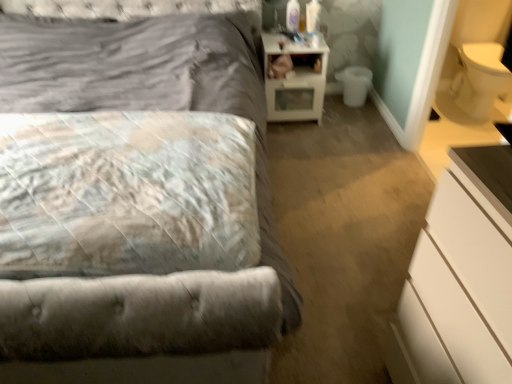
In order to face velvet gray bed at center, should I rotate leftwards or rightwards?

You should rotate left by 22.504 degrees.

You are a GUI agent. You are given a task and a screenshot of the screen. Output one action in this format:
    pyautogui.click(x=<x>, y=<y>)
    Task: Click on the fluffy white pillow at left
    
    Given the screenshot: What is the action you would take?
    pyautogui.click(x=126, y=193)

From the image's perspective, does white glossy nightstand at upper right appear lower than velvet gray bed at center?

No.

Where is `nightstand that appears on the right of velvet gray bed at center`? nightstand that appears on the right of velvet gray bed at center is located at coordinates (295, 79).

Which is behind, white glossy nightstand at upper right or velvet gray bed at center?

Positioned behind is white glossy nightstand at upper right.

Based on the photo, measure the distance from white glossy nightstand at upper right to velvet gray bed at center.

white glossy nightstand at upper right is 17.91 inches away from velvet gray bed at center.

Considering the relative positions of velvet gray bed at center and fluffy white pillow at left in the image provided, is velvet gray bed at center to the right of fluffy white pillow at left from the viewer's perspective?

In fact, velvet gray bed at center is to the left of fluffy white pillow at left.

From the picture: From the image's perspective, does velvet gray bed at center appear lower than fluffy white pillow at left?

No, from the image's perspective, velvet gray bed at center is not below fluffy white pillow at left.

Is velvet gray bed at center spatially inside fluffy white pillow at left, or outside of it?

velvet gray bed at center exists outside the volume of fluffy white pillow at left.

Are velvet gray bed at center and fluffy white pillow at left beside each other?

No, velvet gray bed at center is not with fluffy white pillow at left.

Looking at this image, does velvet gray bed at center have a larger size compared to white plastic toilet bowl at lower right?

Yes.

Would you say velvet gray bed at center is outside white plastic toilet bowl at lower right?

That's correct, velvet gray bed at center is outside of white plastic toilet bowl at lower right.

Is velvet gray bed at center in front of white plastic toilet bowl at lower right?

Yes, velvet gray bed at center is closer to the viewer.

Can fluffy white pillow at left be found inside white plastic toilet bowl at lower right?

Definitely not — fluffy white pillow at left is not inside white plastic toilet bowl at lower right.

Is white plastic toilet bowl at lower right taller than fluffy white pillow at left?

Yes.

In the scene shown: Considering the relative positions of white plastic toilet bowl at lower right and fluffy white pillow at left in the image provided, is white plastic toilet bowl at lower right to the left or to the right of fluffy white pillow at left?

From the image, it's evident that white plastic toilet bowl at lower right is to the right of fluffy white pillow at left.

Between white plastic toilet bowl at lower right and fluffy white pillow at left, which one has smaller width?

white plastic toilet bowl at lower right.

Measure the distance between fluffy white pillow at left and white matte chest of drawers at lower right.

They are 81.00 centimeters apart.

Which is more to the right, fluffy white pillow at left or white matte chest of drawers at lower right?

white matte chest of drawers at lower right.

Would you say fluffy white pillow at left is outside white matte chest of drawers at lower right?

fluffy white pillow at left is positioned outside white matte chest of drawers at lower right.

From the image's perspective, is fluffy white pillow at left on top of velvet gray bed at center?

No, from the image's perspective, fluffy white pillow at left is not above velvet gray bed at center.

Who is more distant, fluffy white pillow at left or velvet gray bed at center?

fluffy white pillow at left is behind.

Are fluffy white pillow at left and velvet gray bed at center making contact?

There is a gap between fluffy white pillow at left and velvet gray bed at center.

From the picture: Does fluffy white pillow at left contain velvet gray bed at center?

No, velvet gray bed at center is not surrounded by fluffy white pillow at left.

In terms of height, does white glossy nightstand at upper right look taller or shorter compared to white plastic toilet bowl at lower right?

white glossy nightstand at upper right is taller than white plastic toilet bowl at lower right.

In the image, is white glossy nightstand at upper right positioned in front of or behind white plastic toilet bowl at lower right?

white glossy nightstand at upper right is in front of white plastic toilet bowl at lower right.

Does white glossy nightstand at upper right turn towards white plastic toilet bowl at lower right?

No, white glossy nightstand at upper right is not aimed at white plastic toilet bowl at lower right.

From the image's perspective, would you say white glossy nightstand at upper right is positioned over white plastic toilet bowl at lower right?

Yes, from the image's perspective, white glossy nightstand at upper right is on top of white plastic toilet bowl at lower right.

Where is `bed that appears on the left of white glossy nightstand at upper right`? The height and width of the screenshot is (384, 512). bed that appears on the left of white glossy nightstand at upper right is located at coordinates (151, 85).

At what (x,y) coordinates should I click in order to perform the action: click on bed positioned vertically above the fluffy white pillow at left (from a real-world perspective). Please return your answer as a coordinate pair (x, y). Image resolution: width=512 pixels, height=384 pixels. Looking at the image, I should click on (151, 85).

Which object lies nearer to the anchor point white matte chest of drawers at lower right, velvet gray bed at center or white glossy nightstand at upper right?

velvet gray bed at center is positioned closer to the anchor white matte chest of drawers at lower right.

Looking at the image, which one is located closer to white glossy nightstand at upper right, fluffy white pillow at left or white matte chest of drawers at lower right?

The object closer to white glossy nightstand at upper right is fluffy white pillow at left.

Considering their positions, is fluffy white pillow at left positioned closer to velvet gray bed at center than white plastic toilet bowl at lower right?

fluffy white pillow at left.

From the image, which object appears to be farther from fluffy white pillow at left, velvet gray bed at center or white matte chest of drawers at lower right?

The object further to fluffy white pillow at left is white matte chest of drawers at lower right.

Looking at this image, based on their spatial positions, is velvet gray bed at center or fluffy white pillow at left further from white glossy nightstand at upper right?

Based on the image, fluffy white pillow at left appears to be further to white glossy nightstand at upper right.

When comparing their distances from fluffy white pillow at left, does white plastic toilet bowl at lower right or white matte chest of drawers at lower right seem closer?

white matte chest of drawers at lower right is positioned closer to the anchor fluffy white pillow at left.

From the picture: Looking at the image, which one is located further to white matte chest of drawers at lower right, white glossy nightstand at upper right or velvet gray bed at center?

The object further to white matte chest of drawers at lower right is white glossy nightstand at upper right.

Looking at the image, which one is located closer to white matte chest of drawers at lower right, white glossy nightstand at upper right or fluffy white pillow at left?

fluffy white pillow at left is positioned closer to the anchor white matte chest of drawers at lower right.

Identify the location of nightstand positioned between velvet gray bed at center and white plastic toilet bowl at lower right from near to far. The image size is (512, 384). (295, 79).

This screenshot has width=512, height=384. I want to click on chest of drawers between velvet gray bed at center and white plastic toilet bowl at lower right in the front-back direction, so click(460, 278).

Where is `pillow located between white matte chest of drawers at lower right and white plastic toilet bowl at lower right in the depth direction`? pillow located between white matte chest of drawers at lower right and white plastic toilet bowl at lower right in the depth direction is located at coordinates (126, 193).

Locate an element on the screen. The height and width of the screenshot is (384, 512). nightstand positioned between white matte chest of drawers at lower right and white plastic toilet bowl at lower right from near to far is located at coordinates (295, 79).